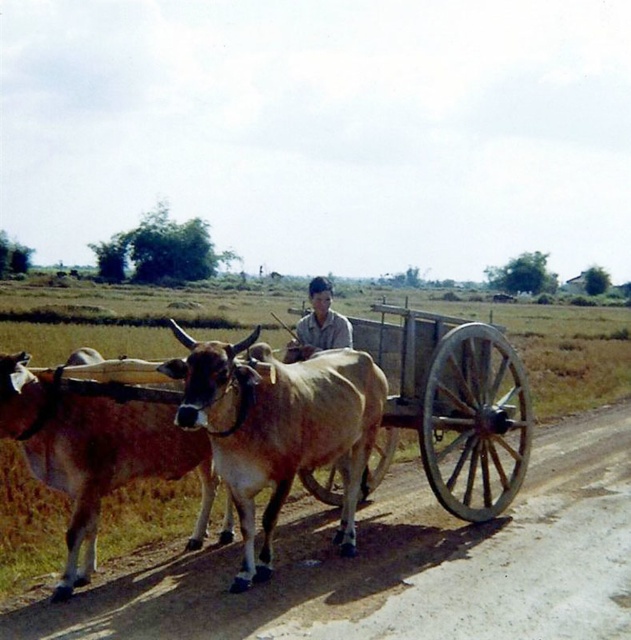
You are a farmer standing at the edge of a field. You have a cart pulled by two oxen and need to load hay bales onto it. The cart is currently 4.63 meters away from the brown glossy bull at center. If your reach is 2 meters, can you throw a rope to secure the hay bales without moving from your spot?

The cart is 4.63 meters away from the brown glossy bull at center. Since your reach is only 2 meters, you cannot throw the rope that far without moving closer.

You are standing at the starting point of the path and want to reach the end of the path. Which direction should you walk to stay on the brown dirt track at lower center?

The brown dirt track at lower center is positioned at coordinates point (403,566), so you should walk in the direction of that coordinate to stay on the path.